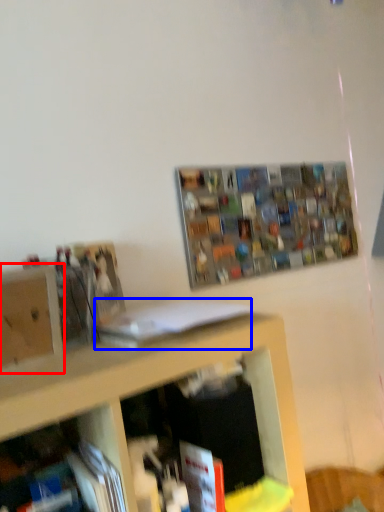
Question: Which object is further to the camera taking this photo, cabinet (highlighted by a red box) or book (highlighted by a blue box)?

Choices:
 (A) cabinet
 (B) book

Answer: (B)